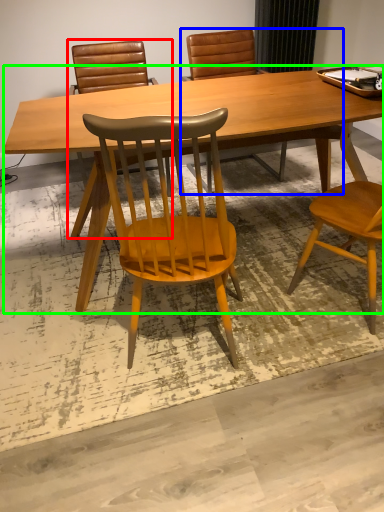
Question: Which object is positioned farthest from chair (highlighted by a red box)? Select from chair (highlighted by a blue box) and desk (highlighted by a green box).

Choices:
 (A) chair
 (B) desk

Answer: (B)